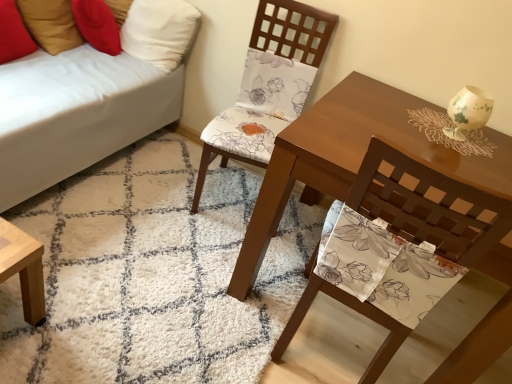
Where is `red fabric pillow at upper left, the 1th pillow when ordered from left to right`? red fabric pillow at upper left, the 1th pillow when ordered from left to right is located at coordinates (13, 34).

Image resolution: width=512 pixels, height=384 pixels. What do you see at coordinates (87, 102) in the screenshot? I see `white fabric couch at lower left` at bounding box center [87, 102].

The height and width of the screenshot is (384, 512). What do you see at coordinates (293, 31) in the screenshot?
I see `matte floral fabric chair at center, marked as the 2th chair in a front-to-back arrangement` at bounding box center [293, 31].

Where is `matte brown table at center`? This screenshot has width=512, height=384. matte brown table at center is located at coordinates coord(350,158).

Locate an element on the screen. Image resolution: width=512 pixels, height=384 pixels. white fabric pillow at upper left, which appears as the 2th pillow when viewed from the left is located at coordinates (159, 31).

The image size is (512, 384). Identify the location of floral fabric chair at center, positioned as the first chair in front-to-back order. (428, 204).

Image resolution: width=512 pixels, height=384 pixels. I want to click on red fabric pillow at upper left, the second pillow viewed from the right, so tap(13, 34).

Is white fabric pillow at upper left, which appears as the 2th pillow when viewed from the left, facing towards white shaggy rug at center?

No, white fabric pillow at upper left, which appears as the 2th pillow when viewed from the left, is not aimed at white shaggy rug at center.

From the image's perspective, is white fabric pillow at upper left, which appears as the 2th pillow when viewed from the left, located beneath white shaggy rug at center?

Incorrect, from the image's perspective, white fabric pillow at upper left, which appears as the 2th pillow when viewed from the left, is higher than white shaggy rug at center.

Would you say white fabric pillow at upper left, which appears as the 2th pillow when viewed from the left, is to the left or to the right of white shaggy rug at center in the picture?

white fabric pillow at upper left, which appears as the 2th pillow when viewed from the left, is positioned on white shaggy rug at center's left side.

Locate an element on the screen. The image size is (512, 384). pillow that is the 2nd one above the white shaggy rug at center (from a real-world perspective) is located at coordinates (159, 31).

Between matte floral fabric chair at center, positioned as the 1th chair in back-to-front order, and floral fabric chair at center, positioned as the first chair in front-to-back order, which one has smaller width?

With smaller width is floral fabric chair at center, positioned as the first chair in front-to-back order.

Is matte floral fabric chair at center, marked as the 2th chair in a front-to-back arrangement, looking in the opposite direction of floral fabric chair at center, positioned as the first chair in front-to-back order?

That's not correct — matte floral fabric chair at center, marked as the 2th chair in a front-to-back arrangement, is not looking away from floral fabric chair at center, positioned as the first chair in front-to-back order.

This screenshot has height=384, width=512. What are the coordinates of `chair that is above the floral fabric chair at center, the 2th chair from the back (from the image's perspective)` in the screenshot? It's located at (293, 31).

Looking at this image, from the image's perspective, which is below, matte floral fabric chair at center, marked as the 2th chair in a front-to-back arrangement, or floral fabric chair at center, the 2th chair from the back?

floral fabric chair at center, the 2th chair from the back, appears lower in the image.

Does matte brown table at center turn towards matte floral fabric chair at center, marked as the 2th chair in a front-to-back arrangement?

No, matte brown table at center is not oriented towards matte floral fabric chair at center, marked as the 2th chair in a front-to-back arrangement.

Which is closer to the camera, (249, 278) or (334, 19)?

Point (249, 278) appears to be closer to the viewer than point (334, 19).

Can you see matte brown table at center touching matte floral fabric chair at center, marked as the 2th chair in a front-to-back arrangement?

No, matte brown table at center is not in contact with matte floral fabric chair at center, marked as the 2th chair in a front-to-back arrangement.

How different are the orientations of matte brown table at center and matte floral fabric chair at center, positioned as the 1th chair in back-to-front order, in degrees?

They differ by 12.1 degrees in their facing directions.

Is red fabric pillow at upper left, the second pillow viewed from the right, oriented away from white fabric couch at lower left?

Yes.

From a real-world perspective, is red fabric pillow at upper left, the 1th pillow when ordered from left to right, physically located above or below white fabric couch at lower left?

In terms of real-world spatial position, red fabric pillow at upper left, the 1th pillow when ordered from left to right, is above white fabric couch at lower left.

Is red fabric pillow at upper left, the second pillow viewed from the right, outside of white fabric couch at lower left?

That's incorrect, red fabric pillow at upper left, the second pillow viewed from the right, is not completely outside white fabric couch at lower left.

From a real-world perspective, which object rests below the other?

matte floral fabric chair at center, marked as the 2th chair in a front-to-back arrangement, is physically lower.

Looking at this image, is matte floral fabric chair at center, marked as the 2th chair in a front-to-back arrangement, inside the boundaries of red fabric pillow at upper left, the second pillow viewed from the right, or outside?

matte floral fabric chair at center, marked as the 2th chair in a front-to-back arrangement, is not enclosed by red fabric pillow at upper left, the second pillow viewed from the right.

Which is nearer, (x=243, y=125) or (x=9, y=10)?

The point (x=9, y=10) is closer to the camera.

From the picture: Which is more to the left, matte floral fabric chair at center, marked as the 2th chair in a front-to-back arrangement, or red fabric pillow at upper left, the second pillow viewed from the right?

From the viewer's perspective, red fabric pillow at upper left, the second pillow viewed from the right, appears more on the left side.

Which is in front, point (267, 44) or point (287, 164)?

The point (287, 164) is more forward.

Does matte floral fabric chair at center, positioned as the 1th chair in back-to-front order, appear on the right side of matte brown table at center?

No, matte floral fabric chair at center, positioned as the 1th chair in back-to-front order, is not to the right of matte brown table at center.

Considering the sizes of matte floral fabric chair at center, marked as the 2th chair in a front-to-back arrangement, and matte brown table at center in the image, is matte floral fabric chair at center, marked as the 2th chair in a front-to-back arrangement, wider or thinner than matte brown table at center?

In the image, matte floral fabric chair at center, marked as the 2th chair in a front-to-back arrangement, appears to be more narrow than matte brown table at center.

From the image's perspective, which one is positioned lower, matte floral fabric chair at center, marked as the 2th chair in a front-to-back arrangement, or matte brown table at center?

matte brown table at center, from the image's perspective.

Can you see matte brown table at center touching white fabric pillow at upper left, which is the first pillow in right-to-left order?

There is a gap between matte brown table at center and white fabric pillow at upper left, which is the first pillow in right-to-left order.

Considering the positions of objects matte brown table at center and white fabric pillow at upper left, which is the first pillow in right-to-left order, in the image provided, who is more to the left, matte brown table at center or white fabric pillow at upper left, which is the first pillow in right-to-left order,?

white fabric pillow at upper left, which is the first pillow in right-to-left order.

From a real-world perspective, which object stands above the other?

white fabric pillow at upper left, which appears as the 2th pillow when viewed from the left, is physically above.

Considering the sizes of objects matte brown table at center and white fabric pillow at upper left, which is the first pillow in right-to-left order, in the image provided, who is shorter, matte brown table at center or white fabric pillow at upper left, which is the first pillow in right-to-left order,?

Standing shorter between the two is white fabric pillow at upper left, which is the first pillow in right-to-left order.

Where is `mat lying on the right of white fabric pillow at upper left, which appears as the 2th pillow when viewed from the left`? This screenshot has height=384, width=512. mat lying on the right of white fabric pillow at upper left, which appears as the 2th pillow when viewed from the left is located at coordinates (151, 274).

Image resolution: width=512 pixels, height=384 pixels. What are the coordinates of `chair to the left of floral fabric chair at center, positioned as the first chair in front-to-back order` in the screenshot? It's located at (293, 31).

From the image, which object appears to be nearer to white fabric couch at lower left, matte floral fabric chair at center, marked as the 2th chair in a front-to-back arrangement, or white shaggy rug at center?

The object closer to white fabric couch at lower left is white shaggy rug at center.

From the image, which object appears to be farther from red fabric pillow at upper left, the 1th pillow when ordered from left to right, floral fabric chair at center, positioned as the first chair in front-to-back order, or matte brown table at center?

Based on the image, floral fabric chair at center, positioned as the first chair in front-to-back order, appears to be further to red fabric pillow at upper left, the 1th pillow when ordered from left to right.

From the image, which object appears to be farther from red fabric pillow at upper left, the second pillow viewed from the right, matte floral fabric chair at center, positioned as the 1th chair in back-to-front order, or matte brown table at center?

matte brown table at center is further to red fabric pillow at upper left, the second pillow viewed from the right.

Which object lies nearer to the anchor point floral fabric chair at center, the 2th chair from the back, white shaggy rug at center or white fabric couch at lower left?

Based on the image, white shaggy rug at center appears to be nearer to floral fabric chair at center, the 2th chair from the back.

In the scene shown: Estimate the real-world distances between objects in this image. Which object is further from matte floral fabric chair at center, positioned as the 1th chair in back-to-front order, matte brown table at center or floral fabric chair at center, positioned as the first chair in front-to-back order?

floral fabric chair at center, positioned as the first chair in front-to-back order, is positioned further to the anchor matte floral fabric chair at center, positioned as the 1th chair in back-to-front order.

In the scene shown: From the image, which object appears to be nearer to white fabric couch at lower left, matte brown table at center or white fabric pillow at upper left, which is the first pillow in right-to-left order?

Based on the image, white fabric pillow at upper left, which is the first pillow in right-to-left order, appears to be nearer to white fabric couch at lower left.

Looking at the image, which one is located closer to red fabric pillow at upper left, the 1th pillow when ordered from left to right, floral fabric chair at center, the 2th chair from the back, or white fabric pillow at upper left, which is the first pillow in right-to-left order?

white fabric pillow at upper left, which is the first pillow in right-to-left order.

Considering their positions, is matte floral fabric chair at center, positioned as the 1th chair in back-to-front order, positioned further to red fabric pillow at upper left, the second pillow viewed from the right, than floral fabric chair at center, positioned as the first chair in front-to-back order?

Based on the image, floral fabric chair at center, positioned as the first chair in front-to-back order, appears to be further to red fabric pillow at upper left, the second pillow viewed from the right.

I want to click on pillow between white fabric couch at lower left and matte floral fabric chair at center, positioned as the 1th chair in back-to-front order, in the horizontal direction, so click(159, 31).

In order to click on mat located between white fabric couch at lower left and matte brown table at center in the left-right direction in this screenshot , I will do `click(151, 274)`.

Locate an element on the screen. The width and height of the screenshot is (512, 384). pillow between white fabric couch at lower left and white fabric pillow at upper left, which is the first pillow in right-to-left order, from front to back is located at coordinates (13, 34).

Locate an element on the screen. studio couch between red fabric pillow at upper left, the 1th pillow when ordered from left to right, and white shaggy rug at center, in the vertical direction is located at coordinates (87, 102).